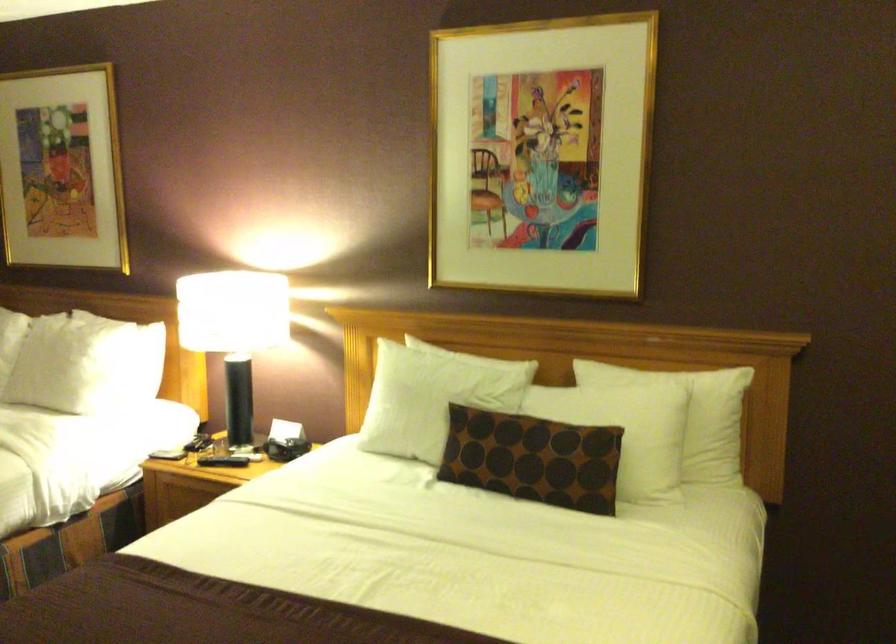
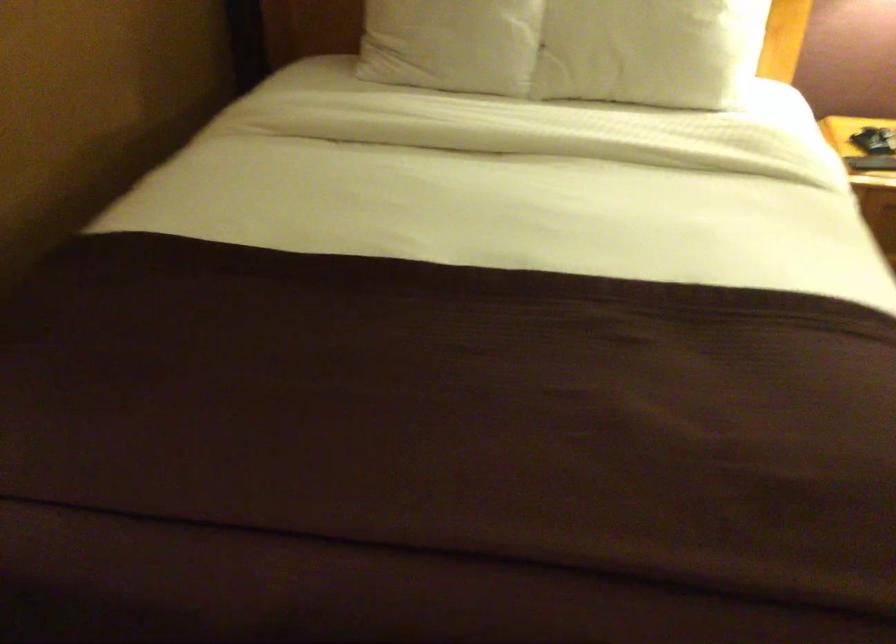
Looking at this image, which direction would the cameraman need to move to produce the second image?

The cameraman walked toward left, forward.